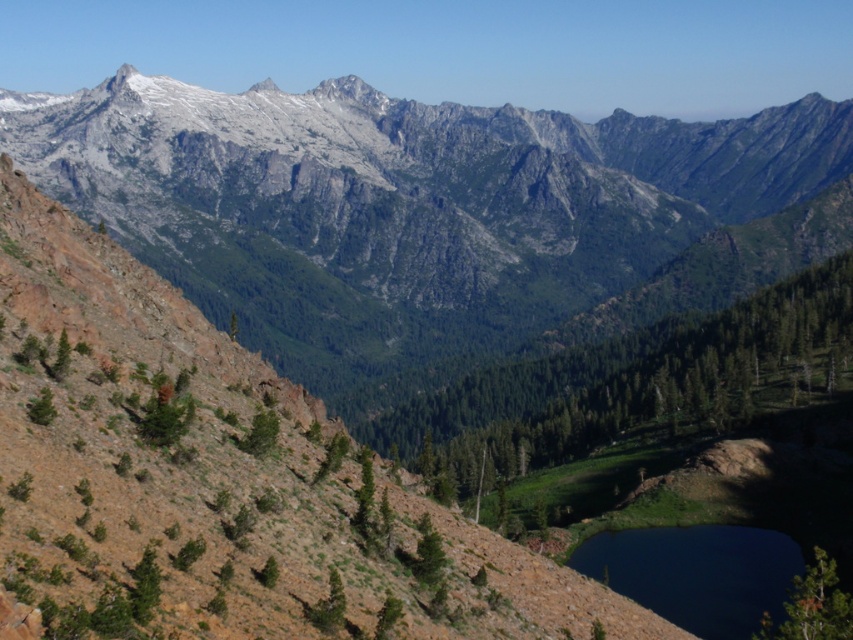
Between point (213, 260) and point (712, 540), which one is positioned in front?

Point (712, 540)

Does point (421, 371) lie behind point (656, 568)?

Yes, point (421, 371) is farther from viewer.

Looking at this image, who is more distant from viewer, (219, 268) or (763, 548)?

The point (219, 268) is behind.

Identify the location of gray rocky mountain range at upper center. click(x=434, y=224).